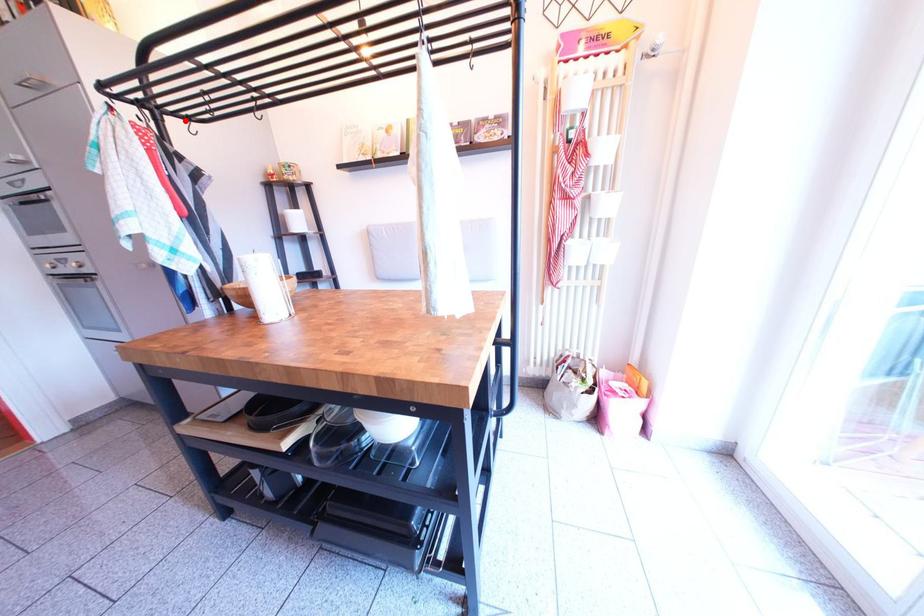
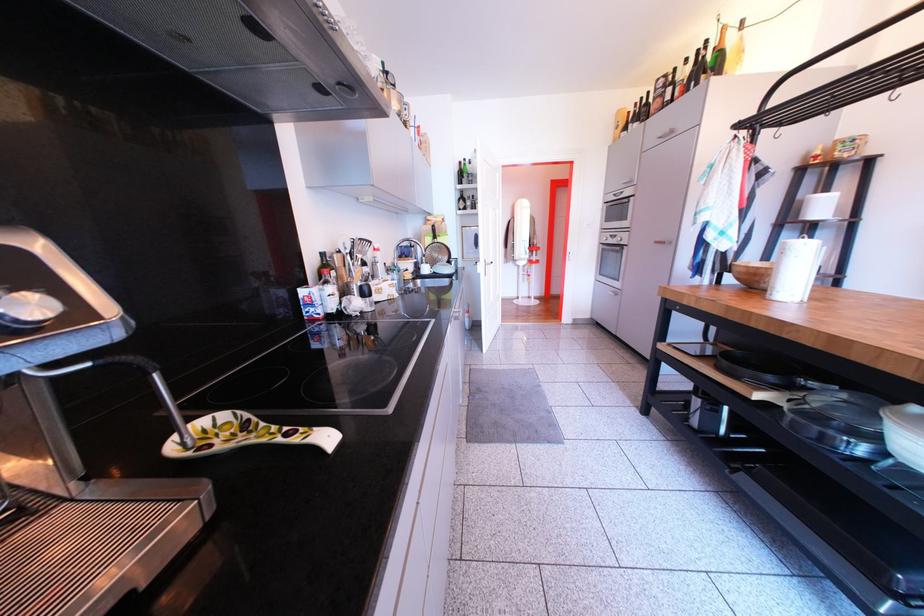
In the second image, find the point that corresponds to the highlighted location in the first image.

(782, 132)